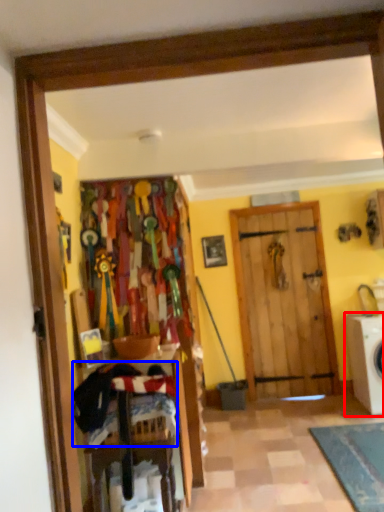
Question: Among these objects, which one is nearest to the camera, washing machine (highlighted by a red box) or laundry (highlighted by a blue box)?

Choices:
 (A) washing machine
 (B) laundry

Answer: (B)